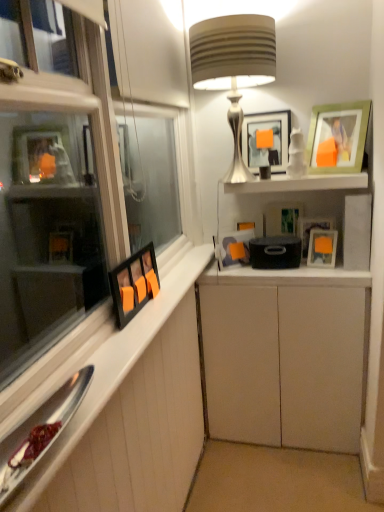
Question: Considering the relative positions of white wood cabinet at left, which is the second cabinetry from right to left, and green matte picture frame at upper right, the first picture frame positioned from the right, in the image provided, is white wood cabinet at left, which is the second cabinetry from right to left, to the left of green matte picture frame at upper right, the first picture frame positioned from the right, from the viewer's perspective?

Choices:
 (A) no
 (B) yes

Answer: (B)

Question: Does white wood cabinet at left, placed as the 1th cabinetry when sorted from left to right, have a greater width compared to green matte picture frame at upper right, the first picture frame positioned from the right?

Choices:
 (A) yes
 (B) no

Answer: (A)

Question: Is white wood cabinet at left, which is the second cabinetry from right to left, bigger than green matte picture frame at upper right, the first picture frame positioned from the right?

Choices:
 (A) no
 (B) yes

Answer: (B)

Question: Is white wood cabinet at left, placed as the 1th cabinetry when sorted from left to right, further to camera compared to green matte picture frame at upper right, the seventh picture frame positioned from the left?

Choices:
 (A) yes
 (B) no

Answer: (B)

Question: Is white wood cabinet at left, placed as the 1th cabinetry when sorted from left to right, positioned in front of green matte picture frame at upper right, the first picture frame positioned from the right?

Choices:
 (A) no
 (B) yes

Answer: (B)

Question: Based on their positions, is matte black picture frame at upper right, which is counted as the 6th picture frame, starting from the right, located to the left or right of green matte picture frame at upper right, the first picture frame positioned from the right?

Choices:
 (A) right
 (B) left

Answer: (B)

Question: Does point (221, 243) appear closer or farther from the camera than point (327, 111)?

Choices:
 (A) farther
 (B) closer

Answer: (A)

Question: In terms of height, does matte black picture frame at upper right, which is the 2th picture frame in left-to-right order, look taller or shorter compared to green matte picture frame at upper right, the seventh picture frame positioned from the left?

Choices:
 (A) tall
 (B) short

Answer: (B)

Question: From a real-world perspective, is matte black picture frame at upper right, which is the 2th picture frame in left-to-right order, above or below green matte picture frame at upper right, the first picture frame positioned from the right?

Choices:
 (A) above
 (B) below

Answer: (B)

Question: Considering the positions of point (349, 167) and point (129, 312), is point (349, 167) closer or farther from the camera than point (129, 312)?

Choices:
 (A) closer
 (B) farther

Answer: (B)

Question: Is green matte picture frame at upper right, the seventh picture frame positioned from the left, spatially inside matte black picture frame at left, placed as the first picture frame when sorted from left to right, or outside of it?

Choices:
 (A) outside
 (B) inside

Answer: (A)

Question: In terms of height, does green matte picture frame at upper right, the seventh picture frame positioned from the left, look taller or shorter compared to matte black picture frame at left, which ranks as the 7th picture frame in right-to-left order?

Choices:
 (A) tall
 (B) short

Answer: (A)

Question: Based on their sizes in the image, would you say green matte picture frame at upper right, the seventh picture frame positioned from the left, is bigger or smaller than matte black picture frame at left, which ranks as the 7th picture frame in right-to-left order?

Choices:
 (A) small
 (B) big

Answer: (B)

Question: Looking at their shapes, would you say white matte cabinet at center, the 2th cabinetry in the left-to-right sequence, is wider or thinner than matte black picture frame at upper right, which is the 2th picture frame in left-to-right order?

Choices:
 (A) wide
 (B) thin

Answer: (A)

Question: From the image's perspective, relative to matte black picture frame at upper right, which is counted as the 6th picture frame, starting from the right, is white matte cabinet at center, positioned as the first cabinetry in right-to-left order, above or below?

Choices:
 (A) above
 (B) below

Answer: (B)